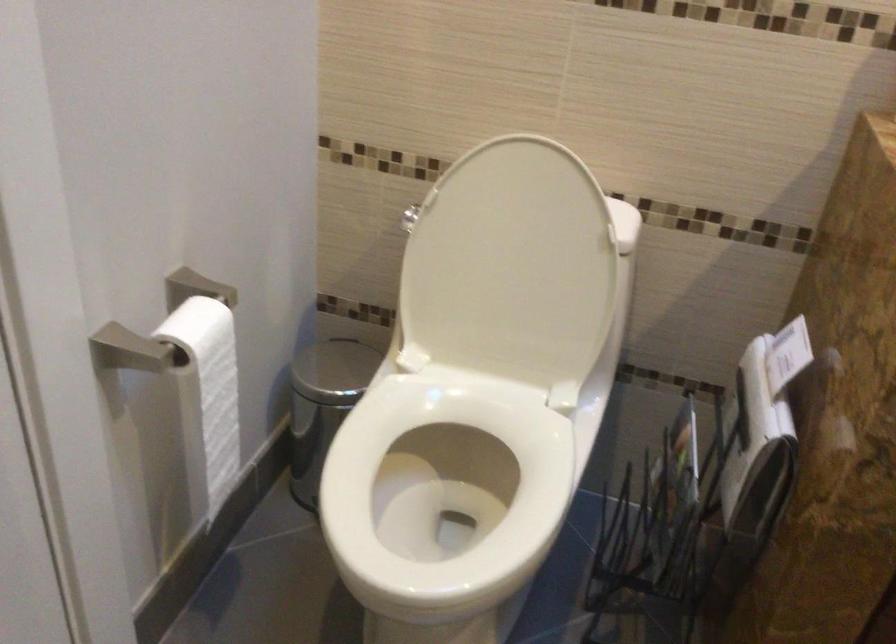
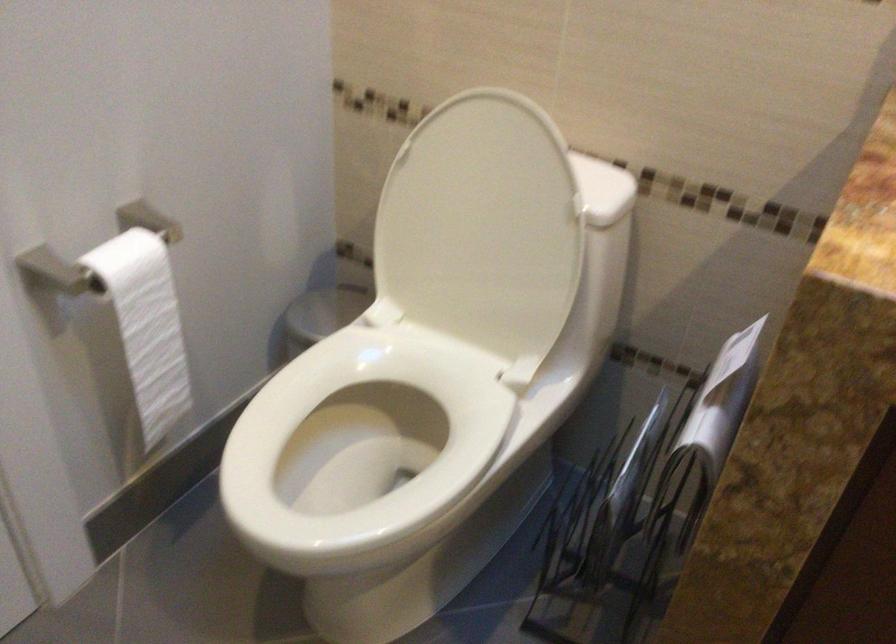
Find the pixel in the second image that matches pixel 513 265 in the first image.

(483, 228)